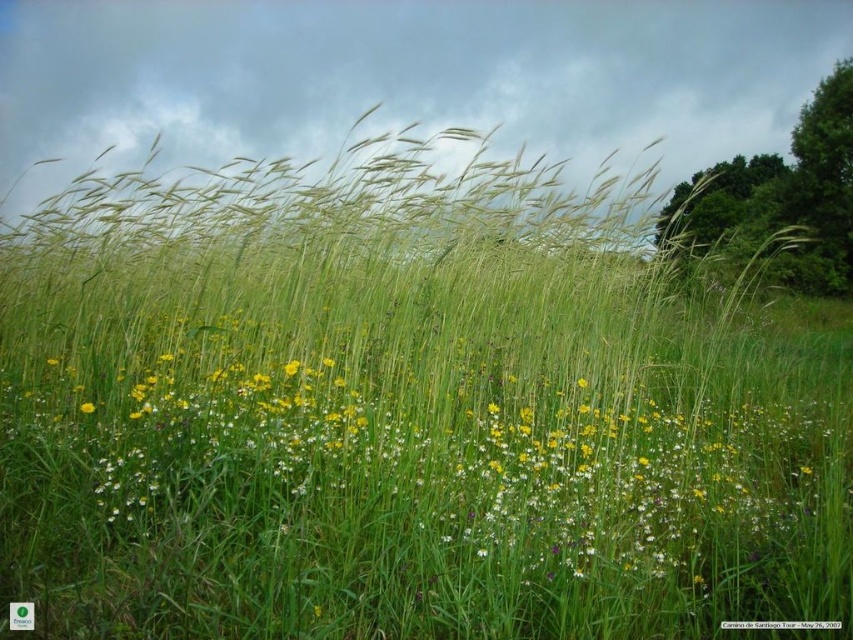
You are a gardener trying to plant a new flower in the field. You have a yellow matte flower at lower left and green grass at center. Which area has more space to accommodate the new flower?

The green grass at center might be wider than yellow matte flower at lower left, so the green grass at center has more space to accommodate the new flower.

You are standing in the field of tall grasses and want to pick the yellow matte flower at lower left. Considering your arm length is 0.7 meters, can you reach it without moving your feet?

The yellow matte flower at lower left is 4.37 meters away from the viewer. Since your arm length is only 0.7 meters, you cannot reach it without moving your feet.